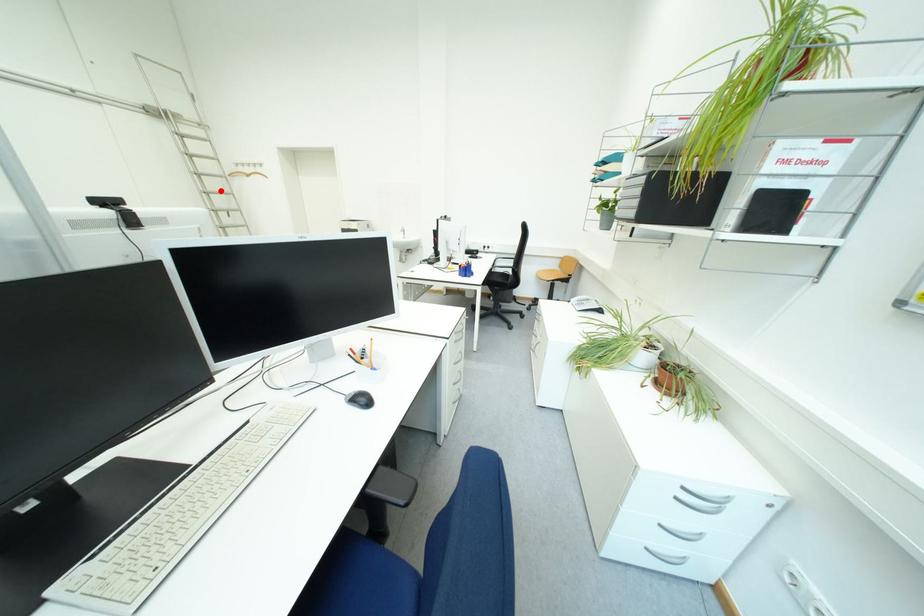
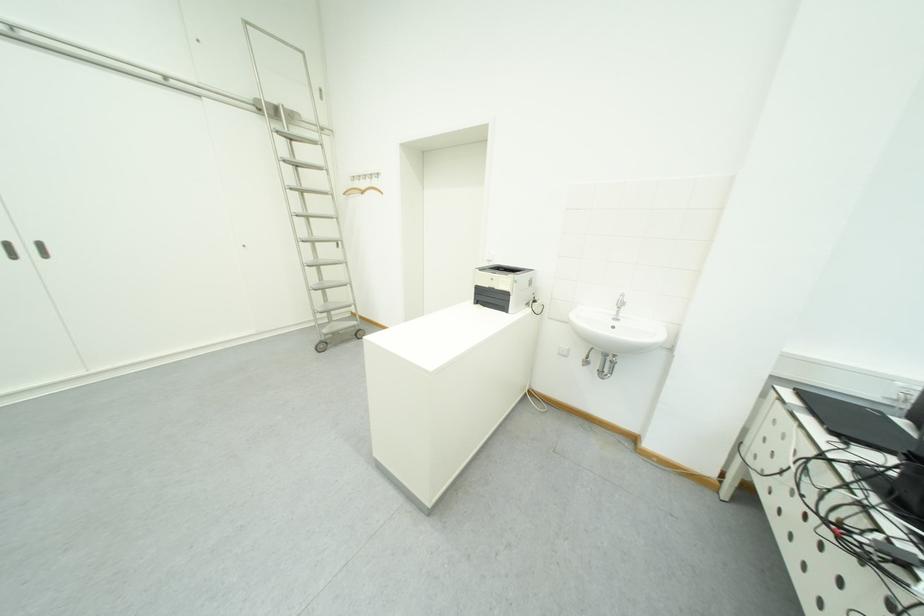
Find the pixel in the second image that matches the highlighted location in the first image.

(322, 213)